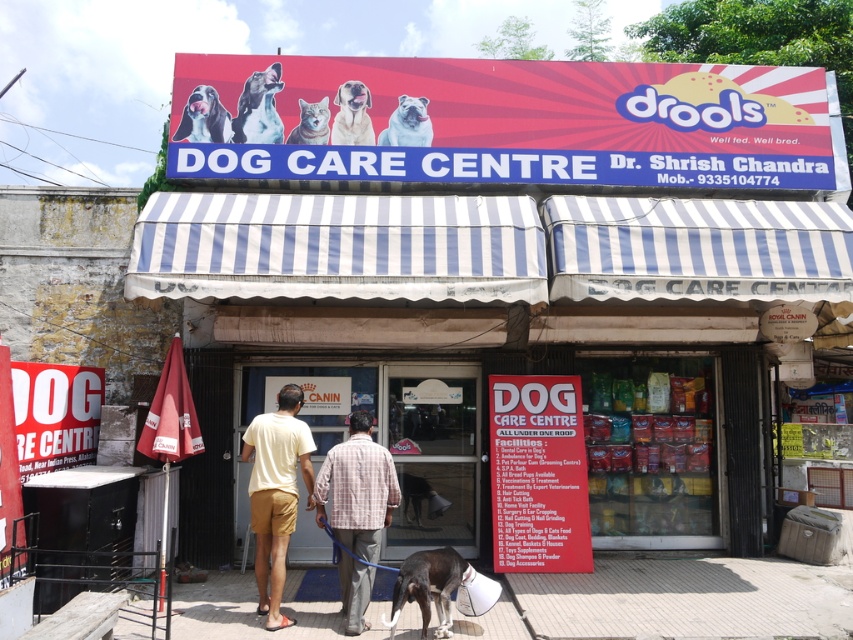
You are a customer entering the Dog Care Centre and see a black smooth dog at lower center and a fluffy white cat at center. Which animal is closer to the entrance?

The black smooth dog at lower center is closer to the entrance because it is in front of the fluffy white cat at center.

You are standing at the entrance of the Dog Care Centre. You see a plaid shirt at center. Where is the plaid shirt located relative to the entrance?

The plaid shirt at center is located at the center of the image, which is directly in front of the entrance.